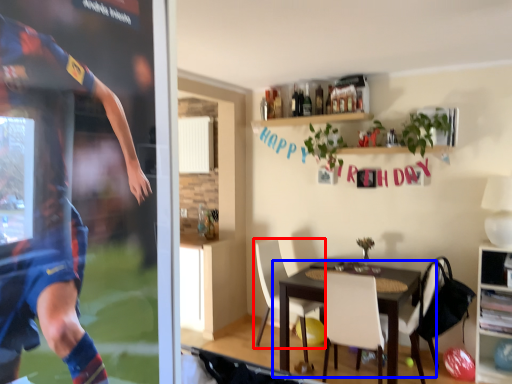
Question: Which of the following is the farthest to the observer, chair (highlighted by a red box) or table (highlighted by a blue box)?

Choices:
 (A) chair
 (B) table

Answer: (A)